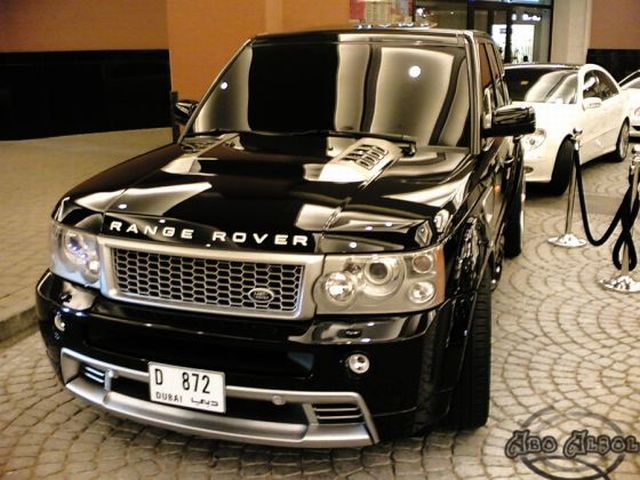
Locate an element on the screen. black wall is located at coordinates (626, 54), (100, 108).